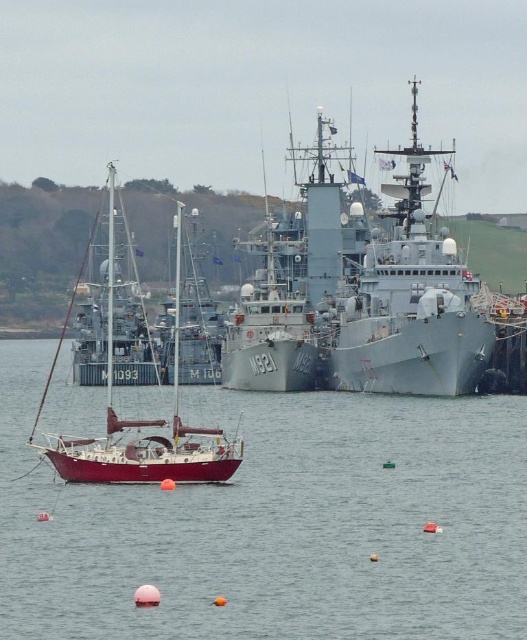
Consider the image. Please provide the coordinates of the gray metallic ship at center in the image. The coordinate system is normalized, with the origin at the bottom left corner.

The gray metallic ship at center is located at coordinates point (411, 301).

You are a sailor who needs to navigate a small boat through the harbor. You see the smooth gray water at center and the shiny red sailboat at center. Which one should you avoid to stay on course?

You should avoid the shiny red sailboat at center because the smooth gray water at center is positioned under it, indicating the sailboat is occupying that area and navigating around it would keep you on course.